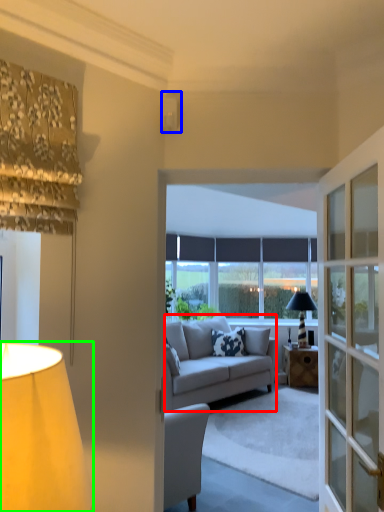
Question: Which object is positioned closest to studio couch (highlighted by a red box)? Select from lamp (highlighted by a blue box) and lamp (highlighted by a green box).

Choices:
 (A) lamp
 (B) lamp

Answer: (A)